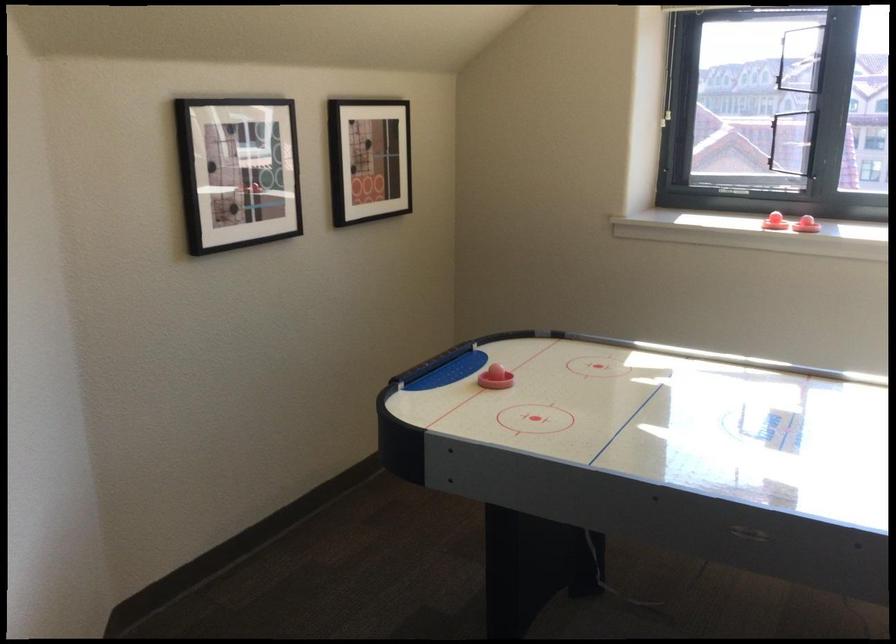
Identify the location of black window handle. (782, 59).